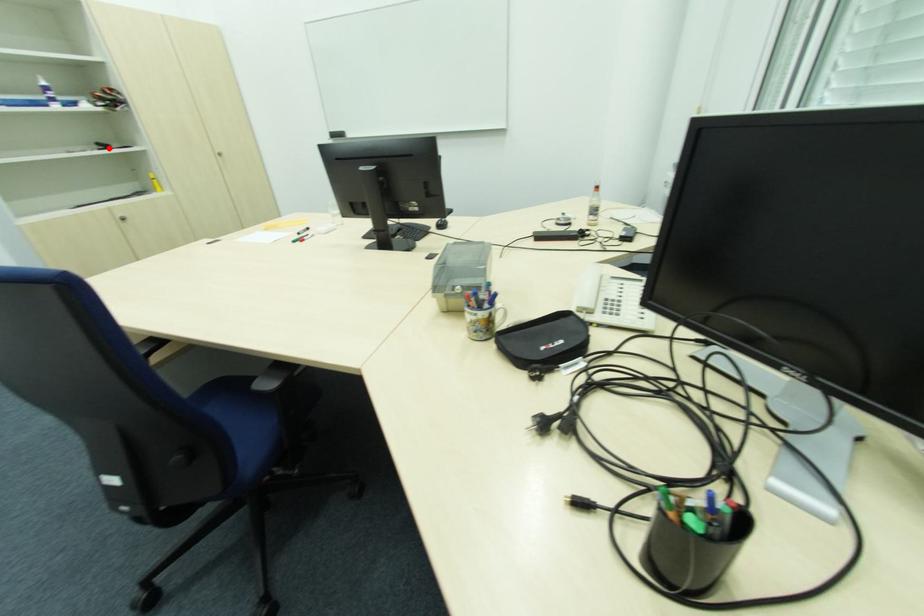
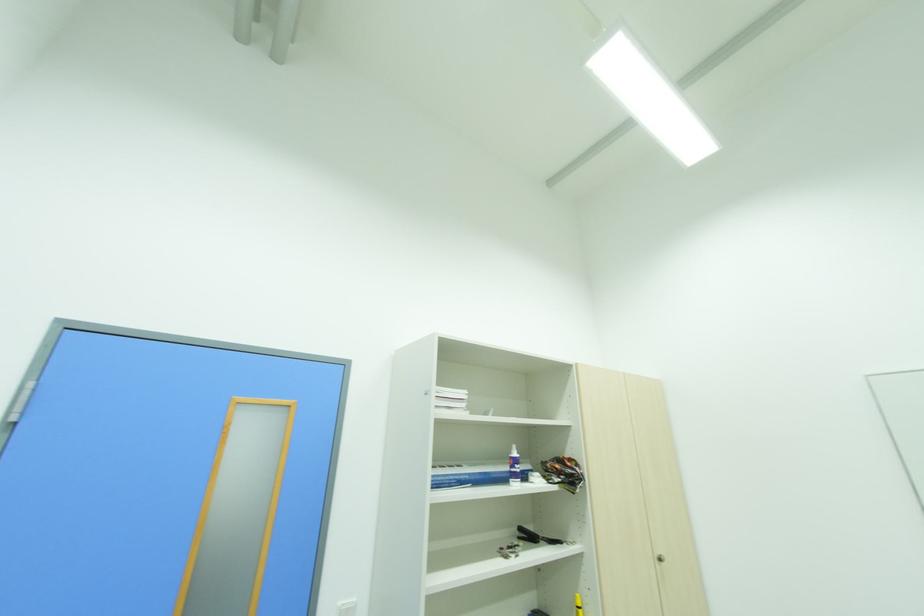
Question: I am providing you with two images of the same scene from different viewpoints. Given a red point in image1, look at the same physical point in image2. Is it:

Choices:
 (A) Closer to the viewpoint
 (B) Farther from the viewpoint

Answer: (A)